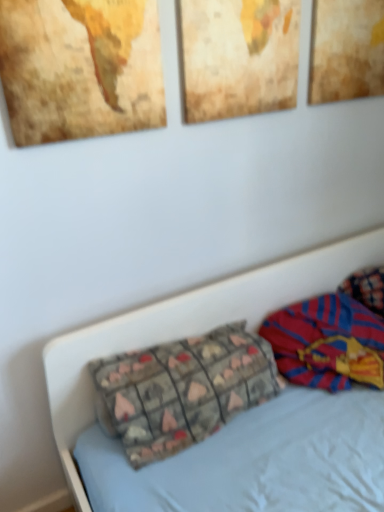
Question: Is wooden map at upper left, which is the first picture frame from left to right, smaller than textured fabric pillow at center?

Choices:
 (A) yes
 (B) no

Answer: (A)

Question: Would you consider wooden map at upper left, which is the first picture frame from left to right, to be distant from textured fabric pillow at center?

Choices:
 (A) yes
 (B) no

Answer: (B)

Question: Does wooden map at upper left, which is the first picture frame from left to right, lie behind textured fabric pillow at center?

Choices:
 (A) yes
 (B) no

Answer: (B)

Question: Does wooden map at upper left, which is the first picture frame from left to right, appear on the right side of textured fabric pillow at center?

Choices:
 (A) no
 (B) yes

Answer: (A)

Question: Does wooden map at upper left, which is the first picture frame from left to right, have a greater height compared to textured fabric pillow at center?

Choices:
 (A) yes
 (B) no

Answer: (A)

Question: Based on their positions, is striped fabric blanket at right located to the left or right of textured paper picture frame at upper right, the 1th picture frame positioned from the right?

Choices:
 (A) left
 (B) right

Answer: (A)

Question: Looking at their shapes, would you say striped fabric blanket at right is wider or thinner than textured paper picture frame at upper right, which is the third picture frame in left-to-right order?

Choices:
 (A) thin
 (B) wide

Answer: (B)

Question: Is striped fabric blanket at right bigger or smaller than textured paper picture frame at upper right, the 1th picture frame positioned from the right?

Choices:
 (A) big
 (B) small

Answer: (A)

Question: Is point (322, 352) positioned closer to the camera than point (332, 5)?

Choices:
 (A) farther
 (B) closer

Answer: (A)

Question: Considering the positions of striped fabric blanket at right and wooden map at upper left, which is the first picture frame from left to right, in the image, is striped fabric blanket at right wider or thinner than wooden map at upper left, which is the first picture frame from left to right,?

Choices:
 (A) wide
 (B) thin

Answer: (A)

Question: Is striped fabric blanket at right situated inside wooden map at upper left, which is the first picture frame from left to right, or outside?

Choices:
 (A) inside
 (B) outside

Answer: (B)

Question: Does point (319, 355) appear closer or farther from the camera than point (137, 87)?

Choices:
 (A) farther
 (B) closer

Answer: (A)

Question: In terms of size, does striped fabric blanket at right appear bigger or smaller than wooden map at upper left, which is the first picture frame from left to right?

Choices:
 (A) small
 (B) big

Answer: (B)

Question: Is point (196, 412) positioned closer to the camera than point (196, 78)?

Choices:
 (A) farther
 (B) closer

Answer: (A)

Question: Is textured fabric pillow at center bigger or smaller than wooden textured picture frame at upper center, placed as the 2th picture frame when sorted from right to left?

Choices:
 (A) small
 (B) big

Answer: (B)